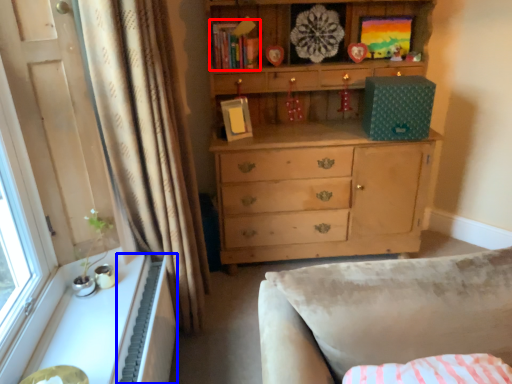
Question: Which object is further to the camera taking this photo, book (highlighted by a red box) or radiator (highlighted by a blue box)?

Choices:
 (A) book
 (B) radiator

Answer: (A)